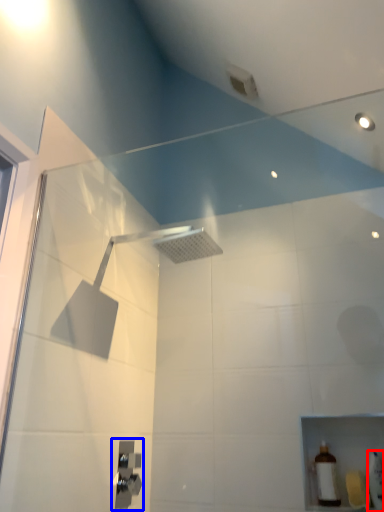
Question: Which object is closer to the camera taking this photo, toiletry (highlighted by a red box) or shower (highlighted by a blue box)?

Choices:
 (A) toiletry
 (B) shower

Answer: (A)